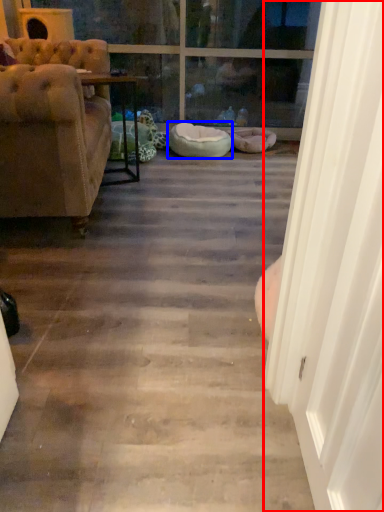
Question: Which of the following is the farthest to the observer, screen door (highlighted by a red box) or dog bed (highlighted by a blue box)?

Choices:
 (A) screen door
 (B) dog bed

Answer: (B)